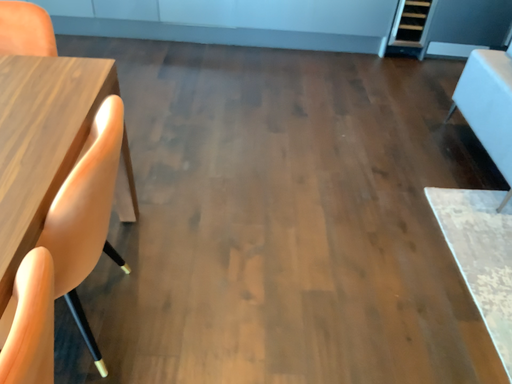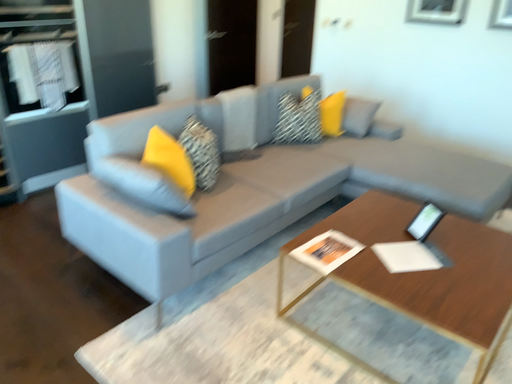
Question: Which way did the camera rotate in the video?

Choices:
 (A) rotated right
 (B) rotated left

Answer: (A)